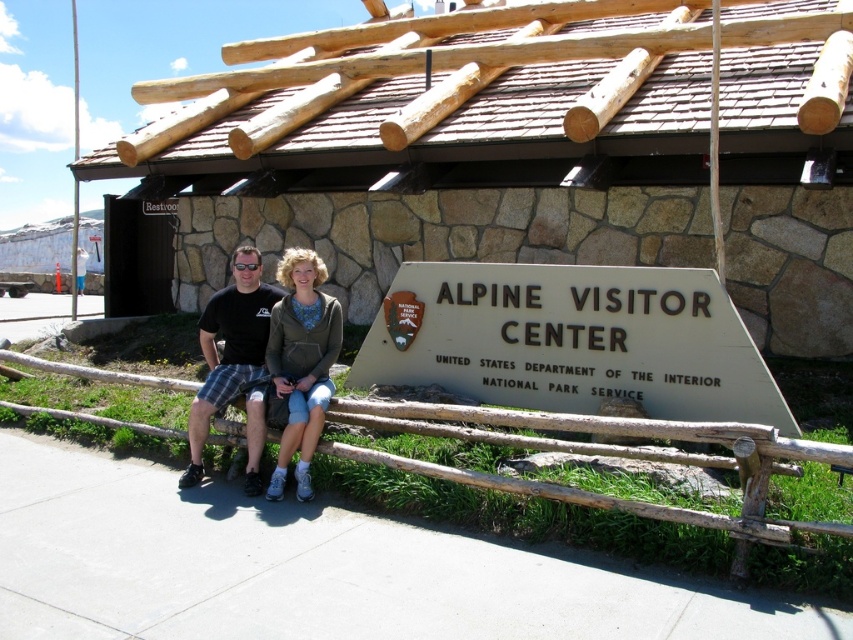
Question: Can you confirm if metallic gray sign at center is positioned below green textured hoodie at center?

Choices:
 (A) yes
 (B) no

Answer: (B)

Question: Estimate the real-world distances between objects in this image. Which object is farther from the green textured hoodie at center?

Choices:
 (A) black plaid shorts at center
 (B) metallic gray sign at center

Answer: (B)

Question: Does green textured hoodie at center come behind black plaid shorts at center?

Choices:
 (A) yes
 (B) no

Answer: (B)

Question: Is metallic gray sign at center wider than black plaid shorts at center?

Choices:
 (A) yes
 (B) no

Answer: (A)

Question: Which of these objects is positioned farthest from the green textured hoodie at center?

Choices:
 (A) black plaid shorts at center
 (B) metallic gray sign at center

Answer: (B)

Question: Which of the following is the closest to the observer?

Choices:
 (A) (590, 403)
 (B) (326, 326)
 (C) (254, 358)

Answer: (B)